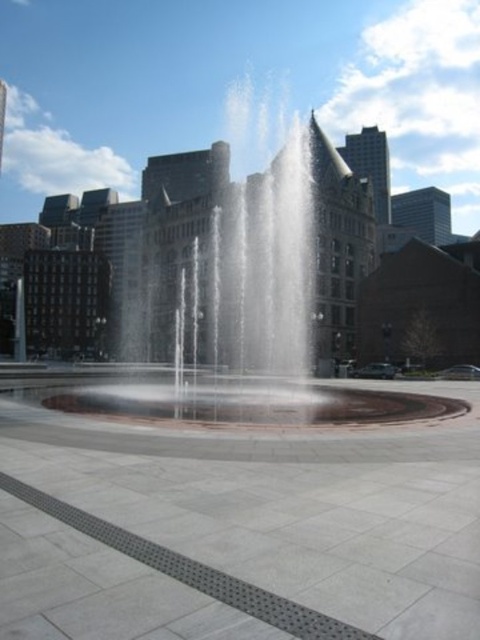
Looking at this image, you are a delivery drone flying over the gray concrete pavement at center and the clear water fountain at center. Which object is taller from your perspective?

The clear water fountain at center is taller than the gray concrete pavement at center, so the clear water fountain at center is taller.

You are standing at the edge of the clear water fountain at center in the urban scene. You want to walk straight ahead towards the triangular roofed building in the background. Will you step onto the gray concrete pavement at center before reaching the building?

The gray concrete pavement at center is to the right of clear water fountain at center, so if you walk straight ahead from the fountain towards the triangular roofed building, you will not step onto the gray concrete pavement at center first. You would reach the building before encountering the pavement on your right side.